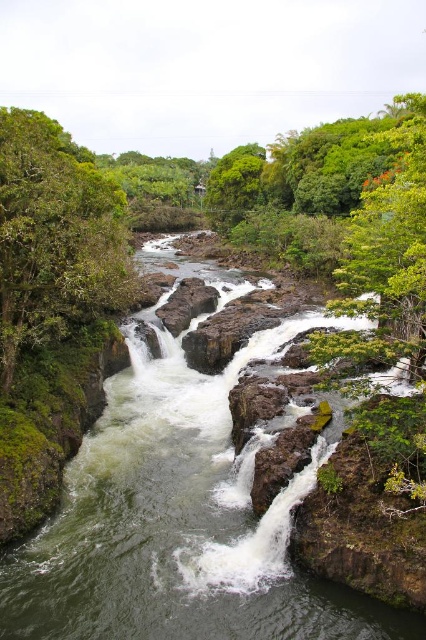
Does white frothy water at center have a larger size compared to rough brown rock at center?

Indeed, white frothy water at center has a larger size compared to rough brown rock at center.

Is white frothy water at center behind rough brown rock at center?

No, white frothy water at center is closer to the viewer.

Who is more forward, (120, 445) or (210, 308)?

Point (120, 445) is more forward.

This screenshot has height=640, width=426. Identify the location of white frothy water at center. (178, 522).

Is green leafy tree at left taller than rough brown rock at center?

Yes.

Who is positioned more to the right, green leafy tree at left or rough brown rock at center?

From the viewer's perspective, rough brown rock at center appears more on the right side.

This screenshot has height=640, width=426. What do you see at coordinates (55, 237) in the screenshot?
I see `green leafy tree at left` at bounding box center [55, 237].

This screenshot has width=426, height=640. Identify the location of green leafy tree at left. (55, 237).

Between point (132, 454) and point (85, 307), which one is positioned in front?

Point (132, 454) is more forward.

What do you see at coordinates (178, 522) in the screenshot? I see `white frothy water at center` at bounding box center [178, 522].

Locate an element on the screen. The height and width of the screenshot is (640, 426). white frothy water at center is located at coordinates (178, 522).